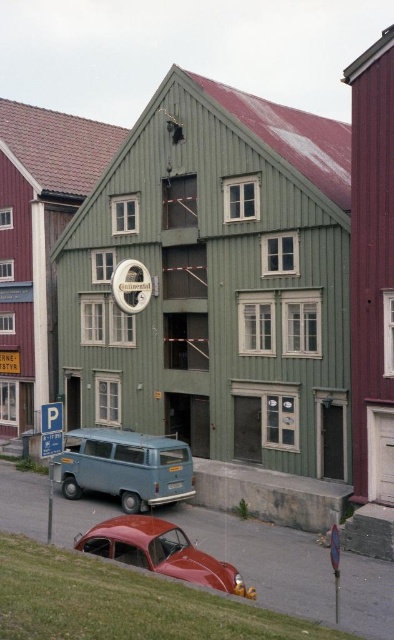
Question: Among these points, which one is nearest to the camera?

Choices:
 (A) (178, 452)
 (B) (172, 552)

Answer: (B)

Question: Where is matte blue van at lower left located in relation to shiny red car at lower left in the image?

Choices:
 (A) left
 (B) right

Answer: (A)

Question: Which object appears farthest from the camera in this image?

Choices:
 (A) shiny red car at lower left
 (B) matte blue van at lower left

Answer: (B)

Question: Is matte blue van at lower left above shiny red car at lower left?

Choices:
 (A) no
 (B) yes

Answer: (B)

Question: Which of the following is the farthest from the observer?

Choices:
 (A) matte blue van at lower left
 (B) shiny red car at lower left

Answer: (A)

Question: Is matte blue van at lower left further to the viewer compared to shiny red car at lower left?

Choices:
 (A) no
 (B) yes

Answer: (B)